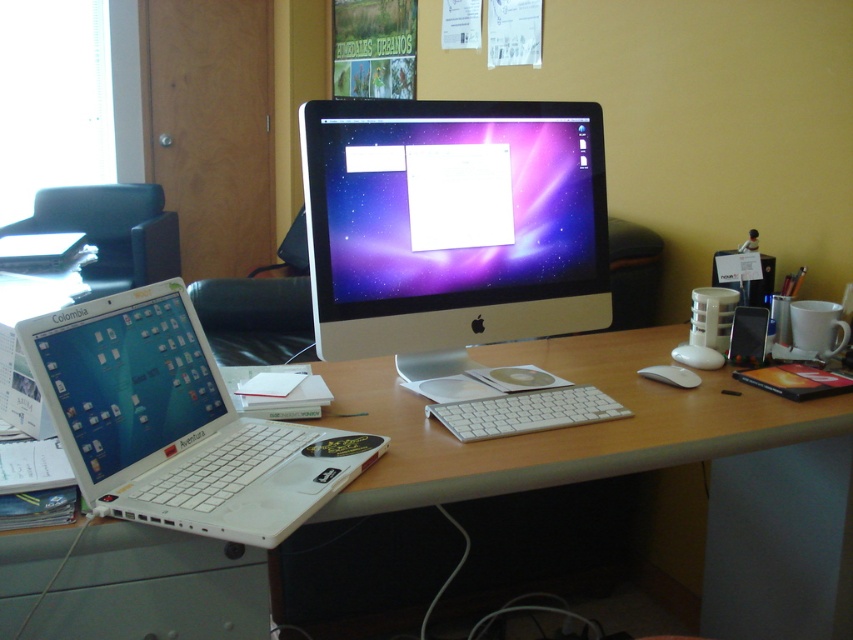
Does white plastic computer desk at center lie in front of white plastic laptop at left?

That is True.

Between white plastic computer desk at center and white plastic laptop at left, which one has more height?

white plastic computer desk at center is taller.

This screenshot has width=853, height=640. What do you see at coordinates (560, 428) in the screenshot? I see `white plastic computer desk at center` at bounding box center [560, 428].

Identify the location of white plastic computer desk at center. The height and width of the screenshot is (640, 853). (560, 428).

Can you confirm if white plastic keyboard at center is positioned below white plastic laptop at left?

Yes, white plastic keyboard at center is below white plastic laptop at left.

Is white plastic keyboard at center bigger than white plastic laptop at left?

No.

Is point (491, 403) positioned in front of point (50, 240)?

Yes, point (491, 403) is in front of point (50, 240).

Find the location of a particular element. The width and height of the screenshot is (853, 640). white plastic keyboard at center is located at coordinates (526, 412).

Between white glossy laptop at lower left and white plastic keyboard at center, which one has less height?

white plastic keyboard at center is shorter.

Does point (225, 408) come behind point (450, 424)?

No, it is not.

Locate an element on the screen. white glossy laptop at lower left is located at coordinates (125, 378).